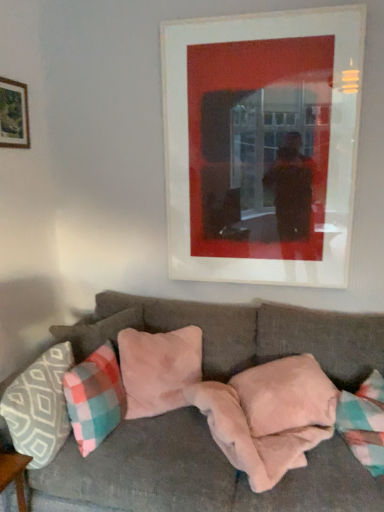
Question: Is plaid fabric pillow at lower left, the third pillow from the right, situated inside wooden frame at upper left, positioned as the 1th picture frame in left-to-right order, or outside?

Choices:
 (A) outside
 (B) inside

Answer: (A)

Question: Is point (89, 448) closer or farther from the camera than point (4, 98)?

Choices:
 (A) closer
 (B) farther

Answer: (A)

Question: Estimate the real-world distances between objects in this image. Which object is farther from the suede-like beige pillow at center, marked as the 4th pillow in a left-to-right arrangement?

Choices:
 (A) matte white picture frame at upper center, acting as the 1th picture frame starting from the right
 (B) pink suede pillow at center, marked as the fourth pillow in a right-to-left arrangement
 (C) velvet gray couch at center
 (D) pink plush pillow at center, the fifth pillow when ordered from left to right
 (E) fuzzy pink blanket at lower center

Answer: (A)

Question: Estimate the real-world distances between objects in this image. Which object is closer to the velvet gray couch at center?

Choices:
 (A) matte white picture frame at upper center, arranged as the second picture frame when viewed from the left
 (B) suede-like beige pillow at center, the second pillow from the right
 (C) patterned fabric pillow at left, placed as the 1th pillow when sorted from left to right
 (D) pink suede pillow at center, marked as the fourth pillow in a right-to-left arrangement
 (E) wooden frame at upper left, which ranks as the 2th picture frame in right-to-left order

Answer: (D)